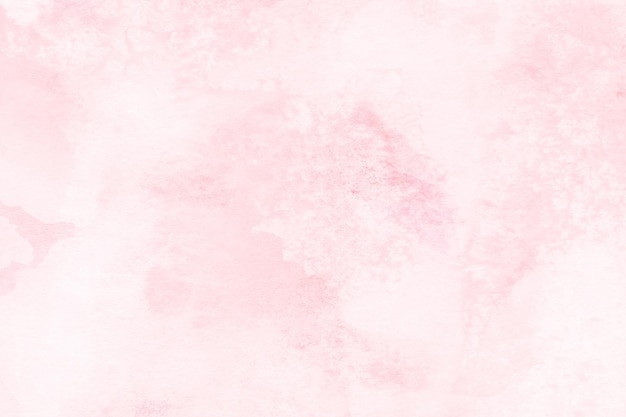
This screenshot has width=626, height=417. I want to click on bottom left corner of surface, so click(1, 414).